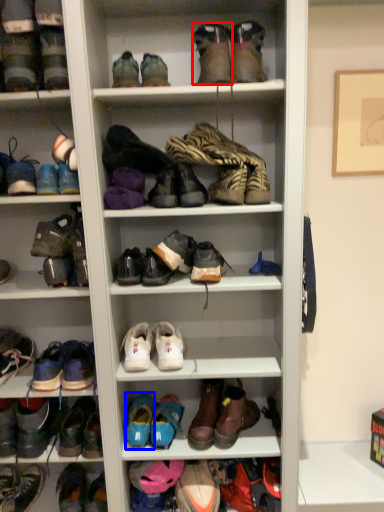
Question: Which of the following is the farthest to the observer, shoe (highlighted by a red box) or shoe (highlighted by a blue box)?

Choices:
 (A) shoe
 (B) shoe

Answer: (B)